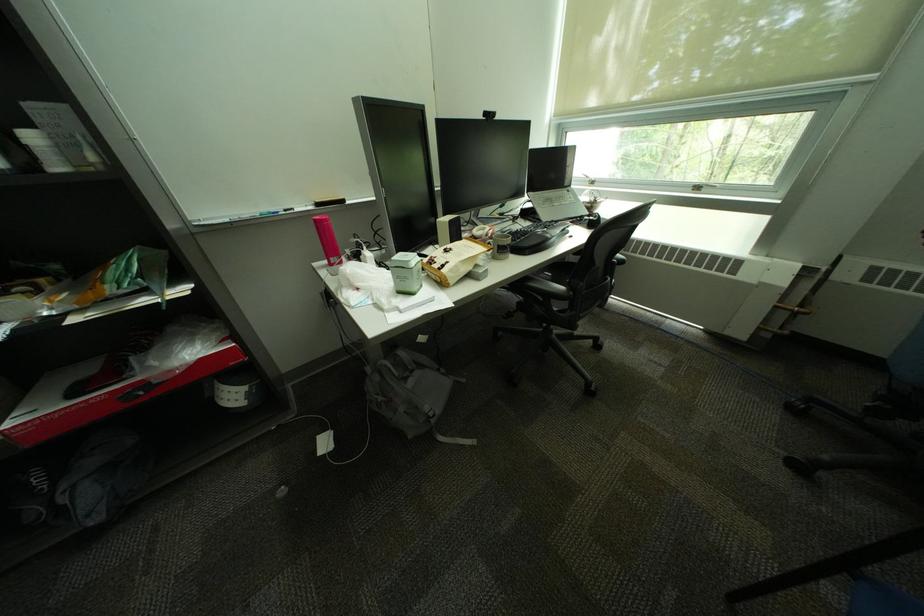
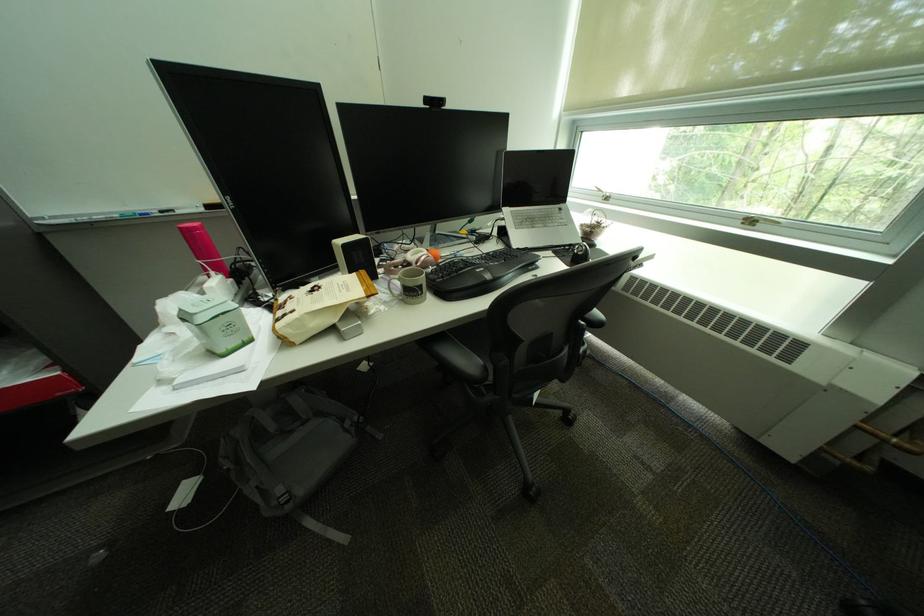
Question: The camera is either moving clockwise (left) or counter-clockwise (right) around the object. The first image is from the beginning of the video and the second image is from the end. Is the camera moving left or right when shooting the video?

Choices:
 (A) Left
 (B) Right

Answer: (B)